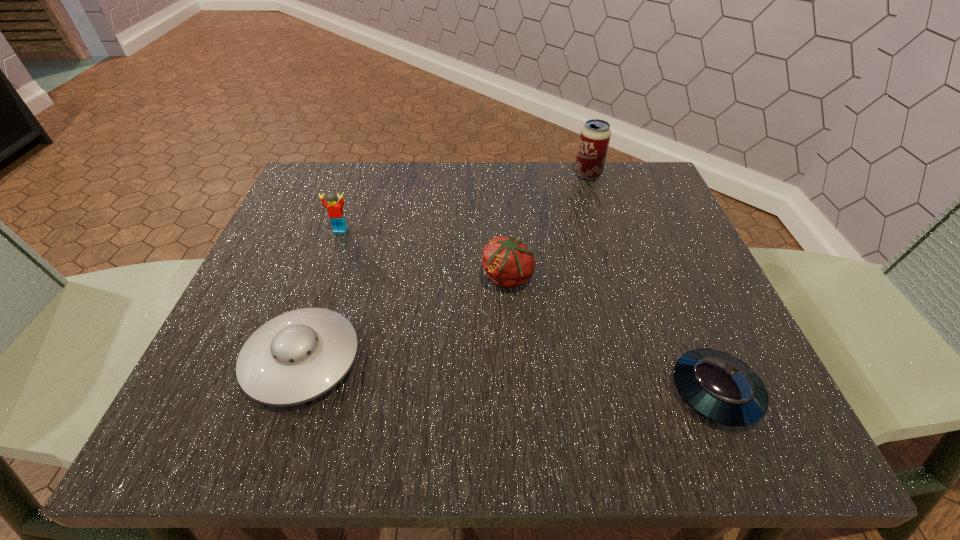
Choose which object is the fourth nearest neighbor to the fourth nearest object. Please provide its 2D coordinates. Your answer should be formatted as a tuple, i.e. [(x, y)], where the tuple contains the x and y coordinates of a point satisfying the conditions above.

[(722, 388)]

Find the location of a particular element. The image size is (960, 540). free location that satisfies the following two spatial constraints: 1. on the back side of the beer can; 2. on the left side of the third object from left to right is located at coordinates (501, 174).

The height and width of the screenshot is (540, 960). Find the location of `free region that satisfies the following two spatial constraints: 1. on the back side of the tomato; 2. on the left side of the farthest object`. free region that satisfies the following two spatial constraints: 1. on the back side of the tomato; 2. on the left side of the farthest object is located at coordinates (501, 174).

The width and height of the screenshot is (960, 540). Find the location of `vacant region that satisfies the following two spatial constraints: 1. on the face of the fourth nearest object; 2. on the left side of the shortest object`. vacant region that satisfies the following two spatial constraints: 1. on the face of the fourth nearest object; 2. on the left side of the shortest object is located at coordinates (283, 392).

Find the location of a particular element. The image size is (960, 540). vacant area that satisfies the following two spatial constraints: 1. on the back side of the taller saucer; 2. on the left side of the third object from right to left is located at coordinates (330, 278).

Identify the location of blank area in the image that satisfies the following two spatial constraints: 1. on the face of the Lego; 2. on the right side of the shortest object. (283, 392).

Image resolution: width=960 pixels, height=540 pixels. Identify the location of free space in the image that satisfies the following two spatial constraints: 1. on the face of the Lego; 2. on the left side of the taller saucer. (295, 360).

Identify the location of free space in the image that satisfies the following two spatial constraints: 1. on the face of the second farthest object; 2. on the left side of the taller saucer. This screenshot has width=960, height=540. (295, 360).